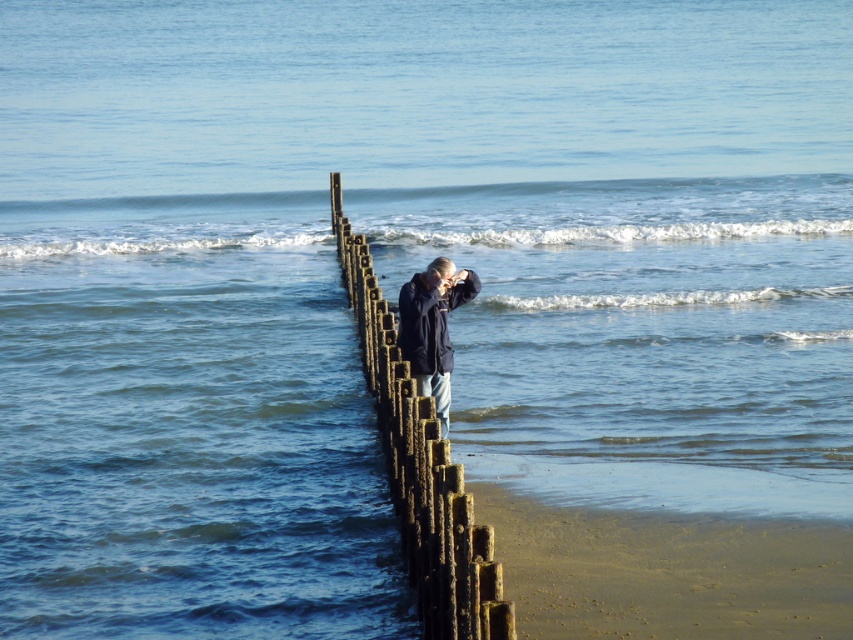
Question: Does wooden post at center appear on the right side of dark blue jacket at center?

Choices:
 (A) yes
 (B) no

Answer: (B)

Question: Among these objects, which one is farthest from the camera?

Choices:
 (A) dark blue jacket at center
 (B) wooden post at center

Answer: (A)

Question: Which point is farther to the camera?

Choices:
 (A) (427, 388)
 (B) (379, 416)

Answer: (B)

Question: Which of the following is the closest to the observer?

Choices:
 (A) (409, 282)
 (B) (334, 225)

Answer: (A)

Question: Is wooden post at center thinner than dark blue jacket at center?

Choices:
 (A) yes
 (B) no

Answer: (B)

Question: Is wooden post at center thinner than dark blue jacket at center?

Choices:
 (A) no
 (B) yes

Answer: (A)